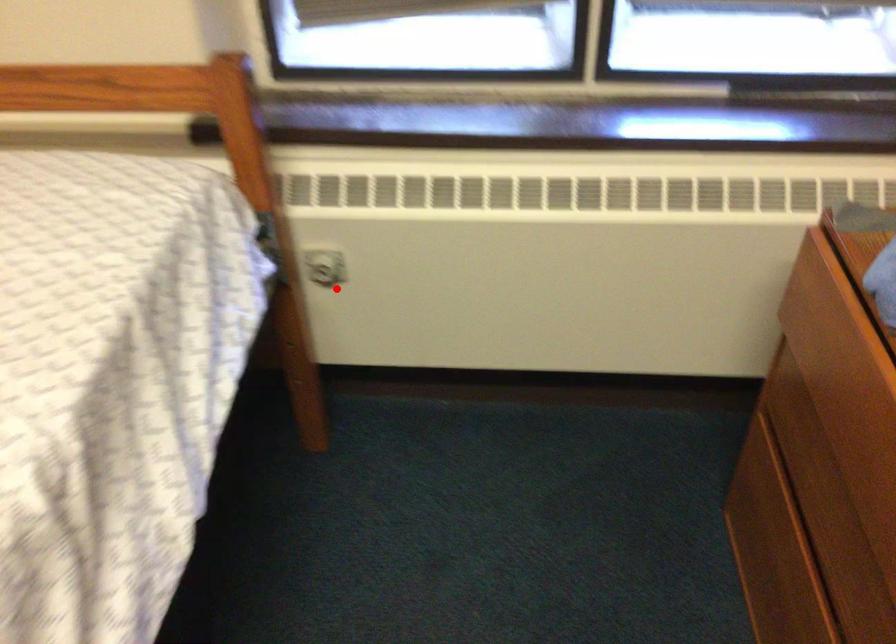
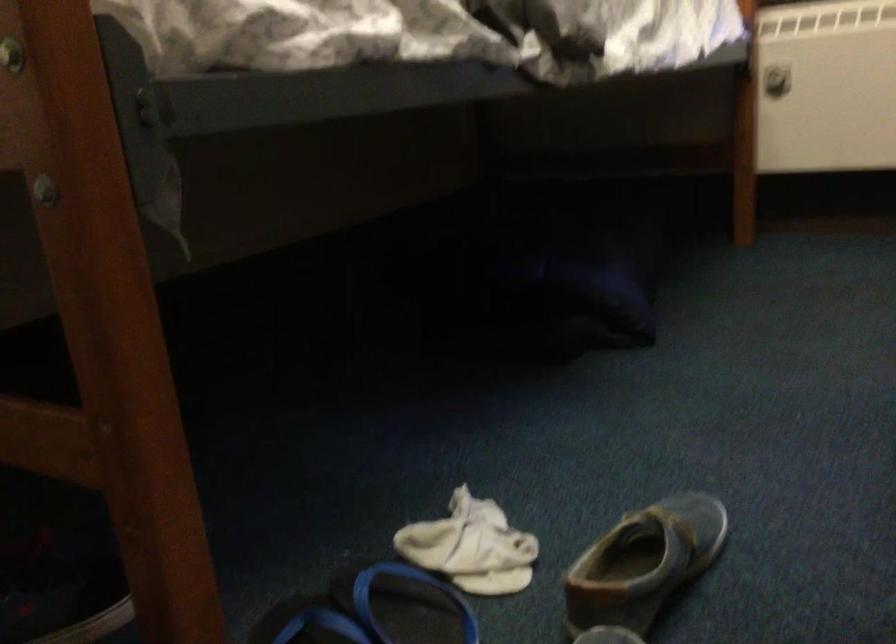
Question: I am providing you with two images of the same scene from different viewpoints. Image1 has a red point marked. In image2, the corresponding 3D location appears at what relative position? Reply with the corresponding letter.

Choices:
 (A) Closer
 (B) Farther

Answer: (B)